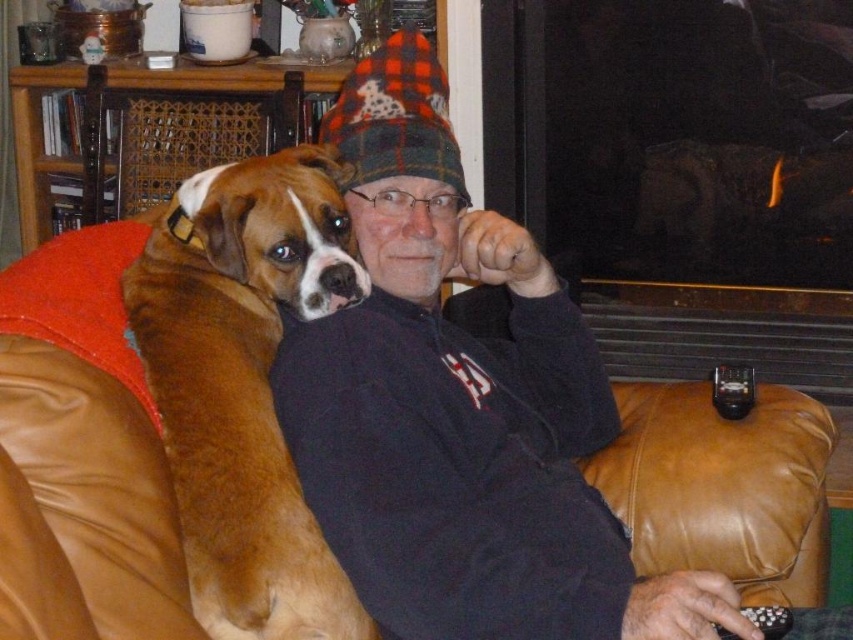
Question: Is brown leather couch at center smaller than brown leather chair at upper left?

Choices:
 (A) yes
 (B) no

Answer: (A)

Question: In this image, where is dark blue fleece jacket at center located relative to brown leather couch at center?

Choices:
 (A) below
 (B) above

Answer: (B)

Question: Which point appears farthest from the camera in this image?

Choices:
 (A) pyautogui.click(x=492, y=224)
 (B) pyautogui.click(x=99, y=177)
 (C) pyautogui.click(x=51, y=557)
 (D) pyautogui.click(x=283, y=588)

Answer: (B)

Question: Which point appears farthest from the camera in this image?

Choices:
 (A) (579, 451)
 (B) (283, 182)
 (C) (134, 528)
 (D) (231, 113)

Answer: (D)

Question: Is brown fur dog at left smaller than brown leather chair at upper left?

Choices:
 (A) no
 (B) yes

Answer: (A)

Question: Which object is the closest to the brown fur dog at left?

Choices:
 (A) dark blue fleece jacket at center
 (B) brown leather chair at upper left
 (C) brown leather couch at center

Answer: (A)